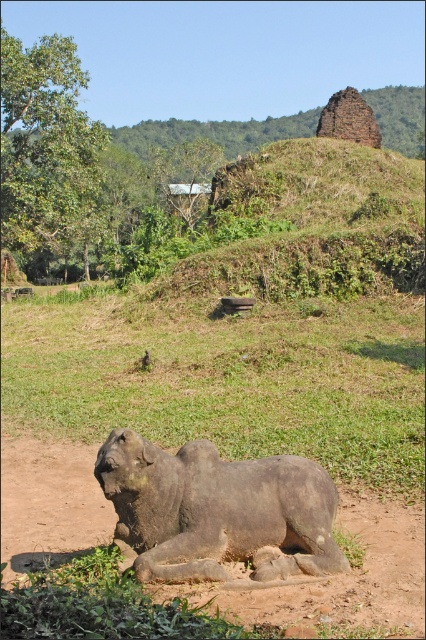
Consider the image. Who is more distant from viewer, (204, 408) or (282, 467)?

Positioned behind is point (204, 408).

Does point (117, 339) come behind point (293, 458)?

Yes.

Locate an element on the screen. green grass at lower center is located at coordinates (230, 380).